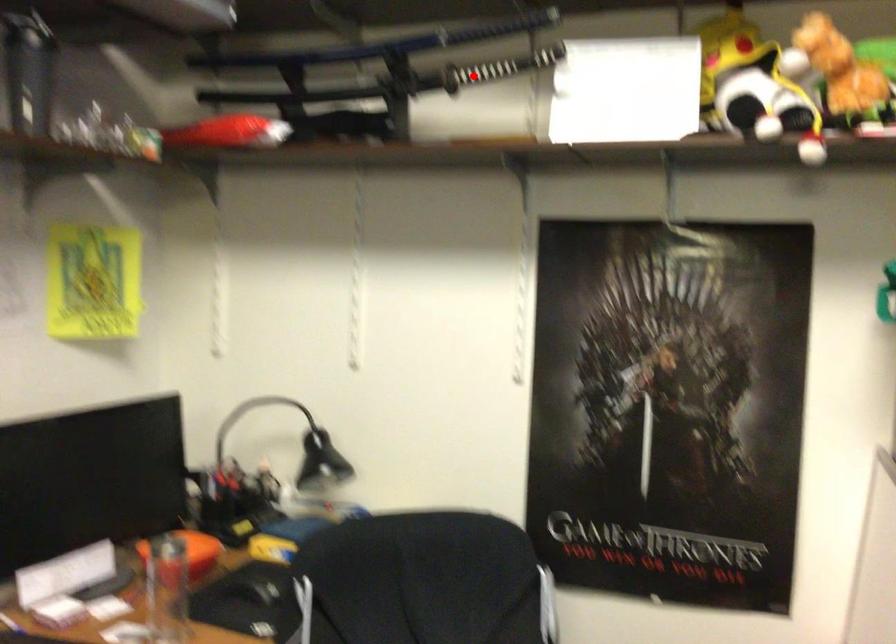
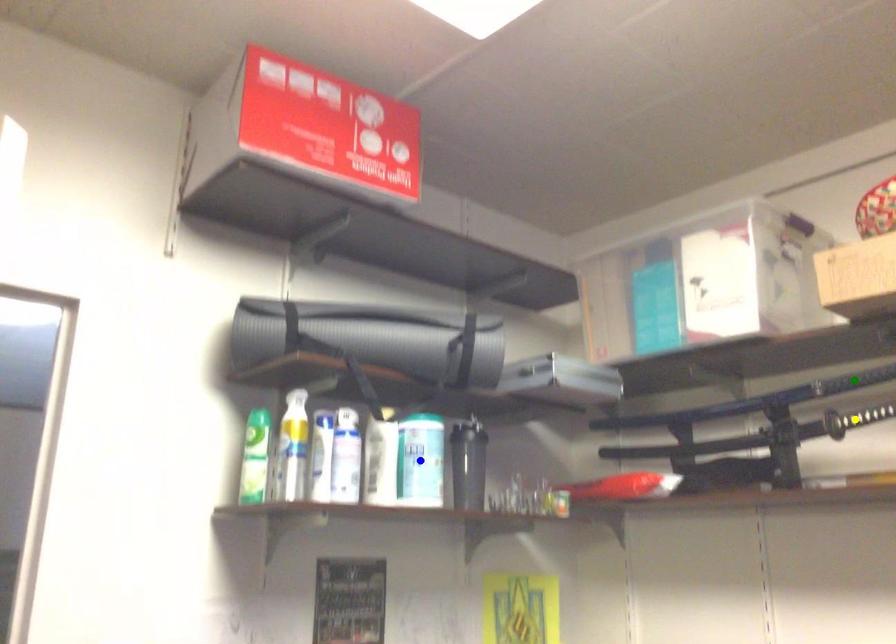
Question: I am providing you with two images of the same scene from different viewpoints. A red point is marked on the first image. You are given multiple points on the second image. Can you choose the point in image 2 that corresponds to the point in image 1?

Choices:
 (A) green point
 (B) yellow point
 (C) blue point

Answer: (B)